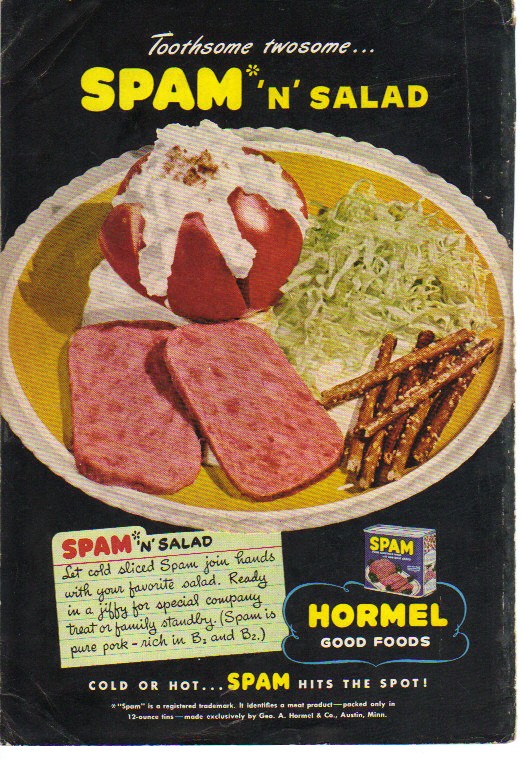
This screenshot has width=521, height=759. Find the location of `dish edge`. dish edge is located at coordinates (299, 524).